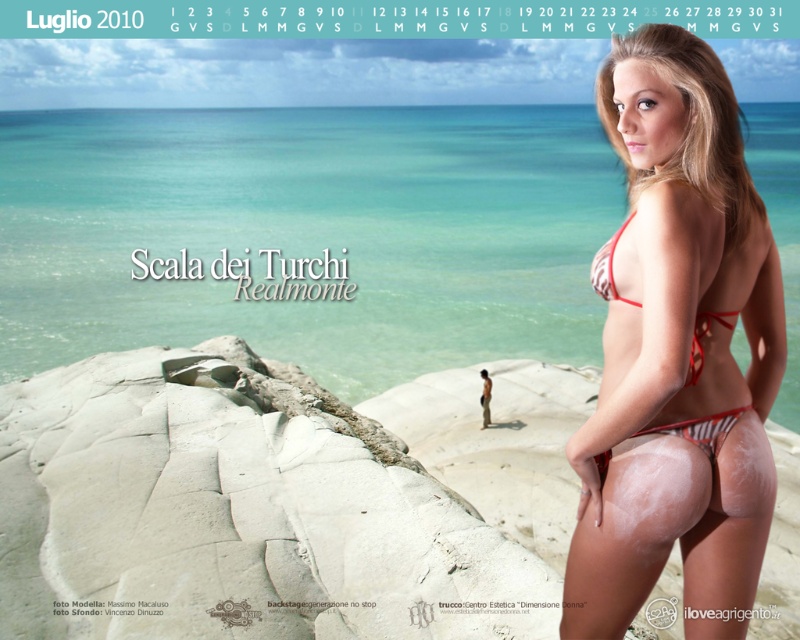
The width and height of the screenshot is (800, 640). Describe the element at coordinates (676, 353) in the screenshot. I see `red bikini at right` at that location.

Between red bikini at right and red striped bikini at right, which one has more height?

With more height is red bikini at right.

Locate an element on the screen. Image resolution: width=800 pixels, height=640 pixels. red bikini at right is located at coordinates (676, 353).

Locate an element on the screen. red bikini at right is located at coordinates (676, 353).

Which is behind, point (760, 189) or point (728, 328)?

The point (760, 189) is behind.

Who is shorter, transparent water at center or red striped bikini at right?

red striped bikini at right

Between point (266, 234) and point (621, 301), which one is positioned in front?

Point (621, 301) is in front.

Where is `transparent water at center`? This screenshot has width=800, height=640. transparent water at center is located at coordinates (308, 234).

Between point (412, 198) and point (566, 625), which one is positioned behind?

The point (412, 198) is behind.

Can you confirm if transparent water at center is bigger than red bikini at right?

Indeed, transparent water at center has a larger size compared to red bikini at right.

Between point (772, 193) and point (782, 365), which one is positioned behind?

The point (772, 193) is behind.

The width and height of the screenshot is (800, 640). I want to click on transparent water at center, so click(308, 234).